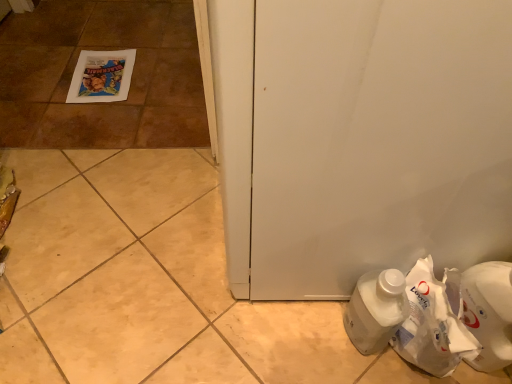
Question: Is white matte door at center behind white paper bag at lower right?

Choices:
 (A) no
 (B) yes

Answer: (A)

Question: From the image's perspective, would you say white matte door at center is shown under white paper bag at lower right?

Choices:
 (A) no
 (B) yes

Answer: (A)

Question: Is white matte door at center wider than white paper bag at lower right?

Choices:
 (A) no
 (B) yes

Answer: (B)

Question: Is the depth of white matte door at center less than that of white paper bag at lower right?

Choices:
 (A) no
 (B) yes

Answer: (B)

Question: Is white matte door at center positioned beyond the bounds of white paper bag at lower right?

Choices:
 (A) yes
 (B) no

Answer: (A)

Question: Is white matte door at center thinner than white paper bag at lower right?

Choices:
 (A) yes
 (B) no

Answer: (B)

Question: From the image's perspective, does white plastic bottle at lower right appear lower than white matte door at center?

Choices:
 (A) yes
 (B) no

Answer: (A)

Question: Does white plastic bottle at lower right have a smaller size compared to white matte door at center?

Choices:
 (A) no
 (B) yes

Answer: (B)

Question: Does white plastic bottle at lower right lie behind white matte door at center?

Choices:
 (A) no
 (B) yes

Answer: (B)

Question: From a real-world perspective, is white plastic bottle at lower right located beneath white matte door at center?

Choices:
 (A) no
 (B) yes

Answer: (B)

Question: Is white plastic bottle at lower right far away from white matte door at center?

Choices:
 (A) yes
 (B) no

Answer: (B)

Question: Is white plastic bottle at lower right oriented towards white matte door at center?

Choices:
 (A) no
 (B) yes

Answer: (A)

Question: Does matte paper poster at upper left appear on the left side of white plastic bottle at lower right?

Choices:
 (A) no
 (B) yes

Answer: (B)